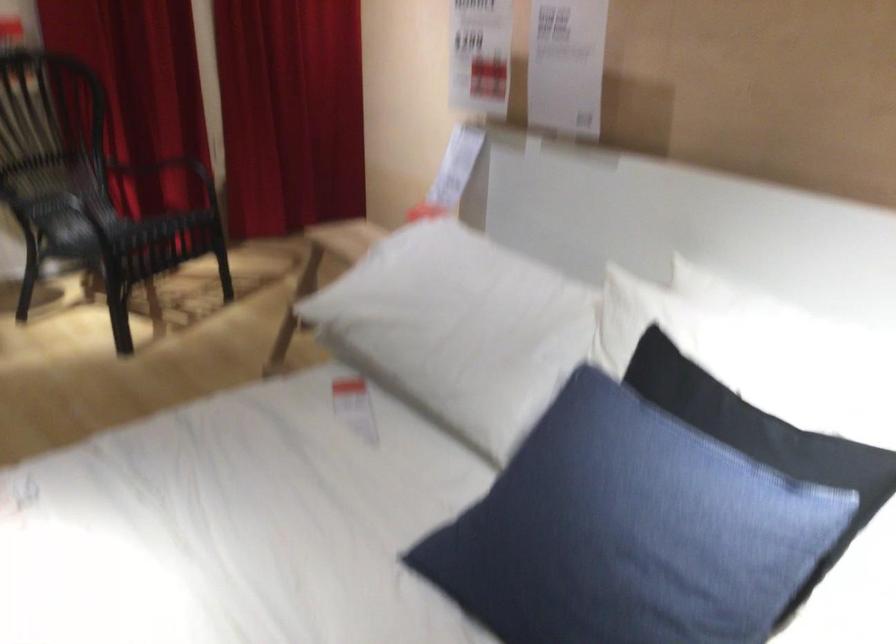
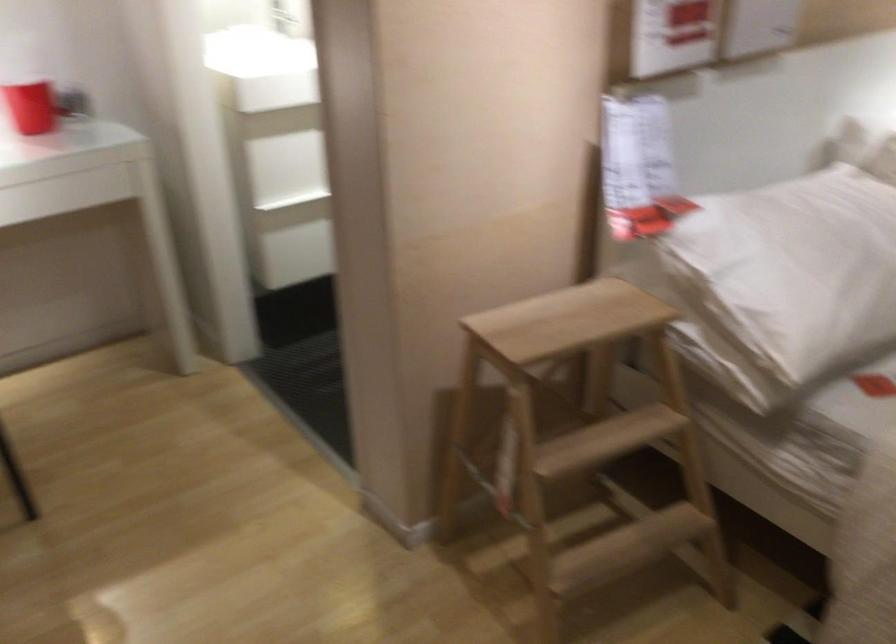
Where in the second image is the point corresponding to (386,281) from the first image?

(785, 281)